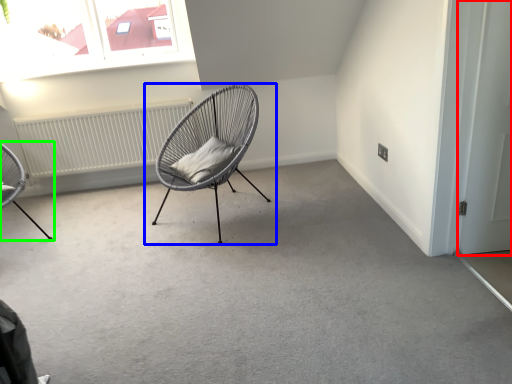
Question: Estimate the real-world distances between objects in this image. Which object is closer to door (highlighted by a red box), chair (highlighted by a blue box) or chair (highlighted by a green box)?

Choices:
 (A) chair
 (B) chair

Answer: (A)